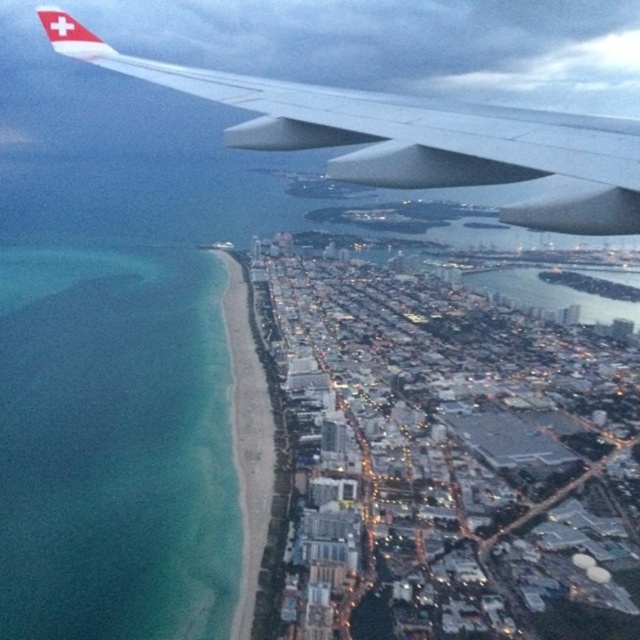
Question: Which point is farther from the camera taking this photo?

Choices:
 (A) (628, 198)
 (B) (125, 337)

Answer: (B)

Question: Does white matte airplane wing at upper left have a greater width compared to beach sand at lower left?

Choices:
 (A) yes
 (B) no

Answer: (A)

Question: Which point is closer to the camera?

Choices:
 (A) (259, 372)
 (B) (220, 88)
 (C) (58, 276)

Answer: (B)

Question: Can you confirm if teal smooth water at lower left is bigger than white matte airplane wing at upper left?

Choices:
 (A) yes
 (B) no

Answer: (B)

Question: Is white matte airplane wing at upper left thinner than beach sand at lower left?

Choices:
 (A) no
 (B) yes

Answer: (A)

Question: Which point appears closest to the camera in this image?

Choices:
 (A) (256, 340)
 (B) (49, 605)
 (C) (422, 170)

Answer: (C)